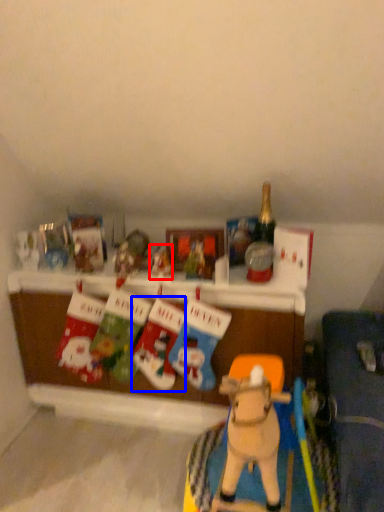
Question: Which of the following is the closest to the observer, toy (highlighted by a red box) or toy (highlighted by a blue box)?

Choices:
 (A) toy
 (B) toy

Answer: (B)